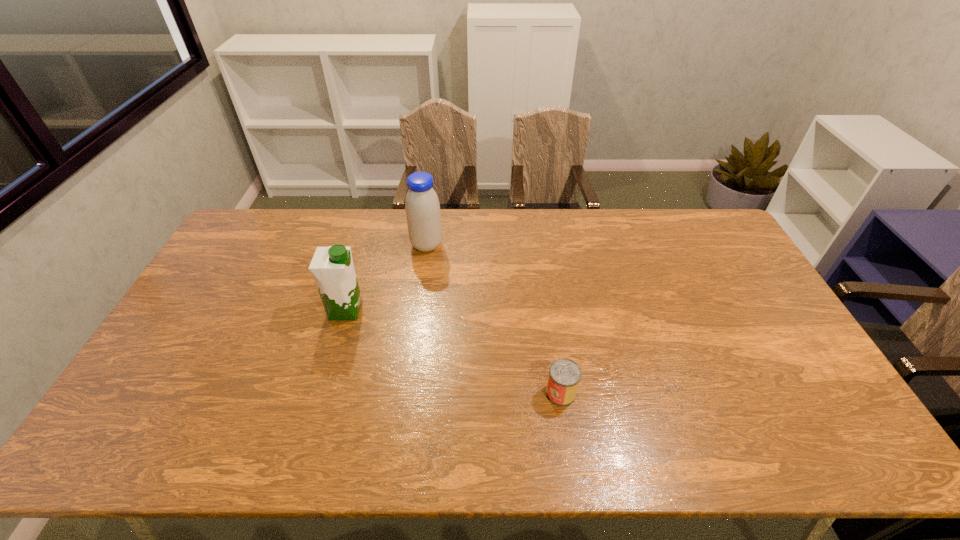
The image size is (960, 540). Identify the location of free spot at the far edge of the desktop. (582, 217).

Image resolution: width=960 pixels, height=540 pixels. Identify the location of vacant space at the near edge. (552, 436).

What are the coordinates of `free space at the left edge of the desktop` in the screenshot? It's located at (206, 285).

In the image, there is a desktop. Where is `free space at the right edge`? The image size is (960, 540). free space at the right edge is located at coordinates (706, 251).

Image resolution: width=960 pixels, height=540 pixels. I want to click on free location at the far left corner, so click(281, 221).

Find the location of `vacant region at the near left corner of the desktop`. vacant region at the near left corner of the desktop is located at coordinates (131, 461).

Locate an element on the screen. The width and height of the screenshot is (960, 540). vacant space at the near right corner is located at coordinates (828, 439).

Where is `vacant region between the farthest object and the leftmost object`? vacant region between the farthest object and the leftmost object is located at coordinates (386, 278).

Locate an element on the screen. The height and width of the screenshot is (540, 960). vacant area that lies between the leftmost object and the rightmost object is located at coordinates (453, 352).

Find the location of `vacant point located between the second farthest object and the farther soya milk`. vacant point located between the second farthest object and the farther soya milk is located at coordinates (386, 278).